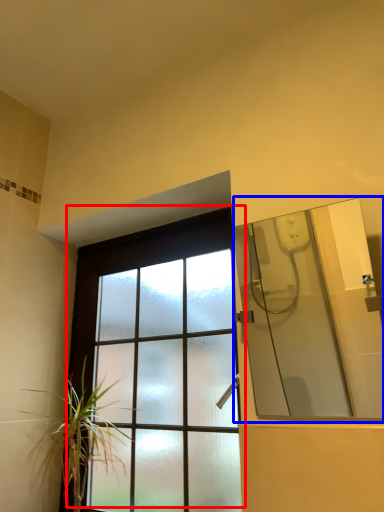
Question: Among these objects, which one is nearest to the camera, window (highlighted by a red box) or mirror (highlighted by a blue box)?

Choices:
 (A) window
 (B) mirror

Answer: (B)